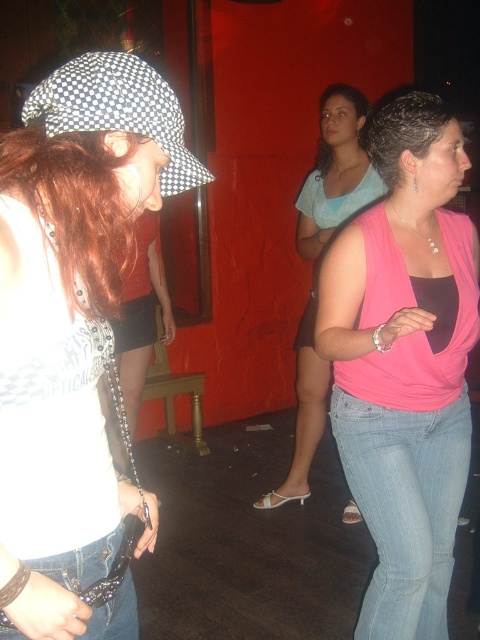
Question: Does matte black hat at left come behind denim jeans at lower left?

Choices:
 (A) yes
 (B) no

Answer: (B)

Question: Estimate the real-world distances between objects in this image. Which object is closer to the denim jeans at lower right?

Choices:
 (A) pink matte tank top at center
 (B) shiny red hair at left
 (C) denim jeans at lower left
 (D) matte black hat at left

Answer: (C)

Question: Which of the following is the closest to the observer?

Choices:
 (A) (352, 99)
 (B) (305, 433)
 (C) (115, 177)

Answer: (C)

Question: Is pink matte tank top at center smaller than brown shiny hair at center?

Choices:
 (A) no
 (B) yes

Answer: (A)

Question: Is shiny red hair at left positioned before pink matte tank top at center?

Choices:
 (A) yes
 (B) no

Answer: (A)

Question: Which object is positioned farthest from the denim jeans at lower left?

Choices:
 (A) pink fabric top at center
 (B) matte black hat at left
 (C) brown shiny hair at center

Answer: (C)